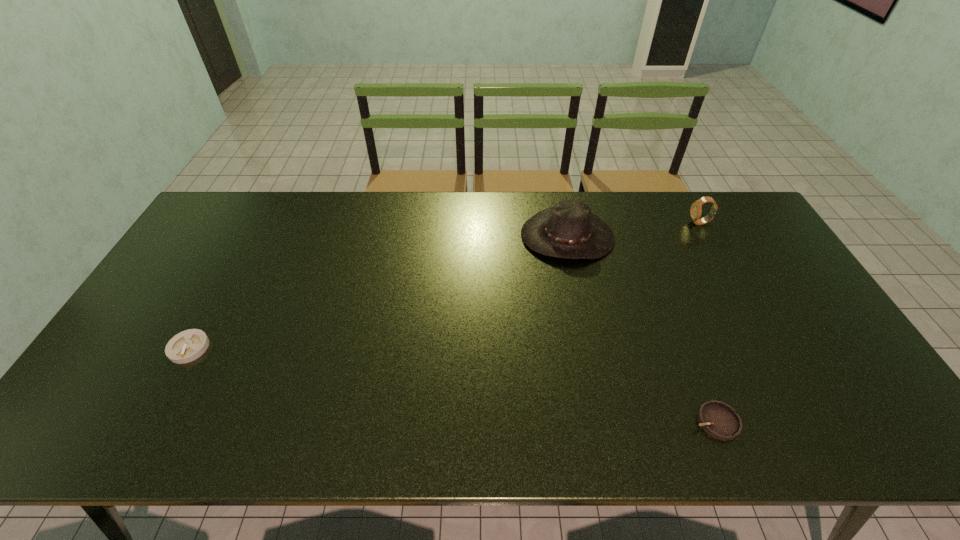
The width and height of the screenshot is (960, 540). Identify the location of hat. (568, 230).

The width and height of the screenshot is (960, 540). I want to click on watch, so click(x=696, y=208).

Find the location of `the left ashtray`. the left ashtray is located at coordinates (186, 346).

The height and width of the screenshot is (540, 960). In order to click on the second nearest object in this screenshot , I will do `click(186, 346)`.

Locate an element on the screen. The image size is (960, 540). the nearest object is located at coordinates (718, 419).

The height and width of the screenshot is (540, 960). In order to click on the nearer ashtray in this screenshot , I will do `click(718, 419)`.

Where is `vacant region located 0.260m on the front-facing side of the third object from right to left`? vacant region located 0.260m on the front-facing side of the third object from right to left is located at coordinates (588, 331).

The width and height of the screenshot is (960, 540). What are the coordinates of `blank space located 0.190m on the face of the rightmost object` in the screenshot? It's located at (634, 222).

Find the location of a particular element. The image size is (960, 540). vacant space situated on the face of the rightmost object is located at coordinates (655, 222).

Image resolution: width=960 pixels, height=540 pixels. I want to click on free space located 0.190m on the face of the rightmost object, so click(634, 222).